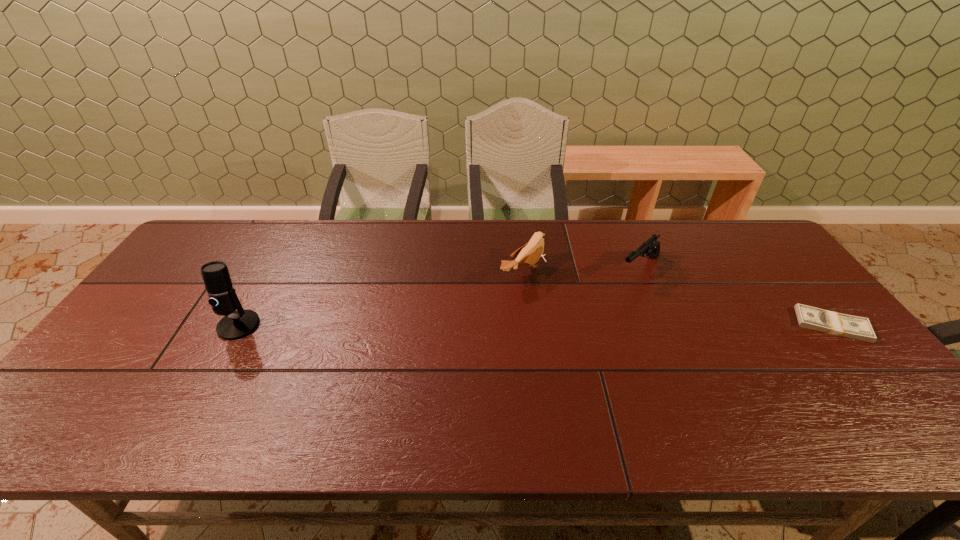
The height and width of the screenshot is (540, 960). Identify the location of free location located 0.320m at the end of the barrel of the third object from left to right. (559, 334).

Identify the location of free space located at the beak of the third object from right to left. [613, 322].

Find the location of a particular element. The height and width of the screenshot is (540, 960). vacant region located at the beak of the third object from right to left is located at coordinates (576, 302).

The width and height of the screenshot is (960, 540). What are the coordinates of `free location located at the beak of the third object from right to left` in the screenshot? It's located at (594, 312).

This screenshot has width=960, height=540. I want to click on gun that is at the far edge, so click(x=651, y=247).

Locate an element on the screen. This screenshot has width=960, height=540. bird positioned at the far edge is located at coordinates (530, 253).

Image resolution: width=960 pixels, height=540 pixels. I want to click on object that is at the right edge, so click(x=808, y=317).

In the image, there is a desktop. Where is `vacant space at the far edge`? vacant space at the far edge is located at coordinates pos(600,244).

In the image, there is a desktop. Identify the location of vacant space at the near edge. This screenshot has width=960, height=540. (326, 404).

Find the location of a particular element. This screenshot has height=540, width=960. vacant space at the left edge of the desktop is located at coordinates (132, 342).